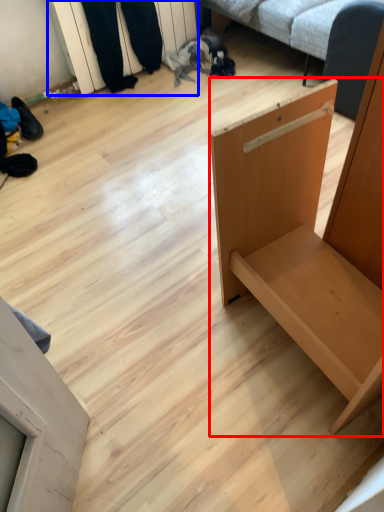
Question: Which of the following is the farthest to the observer, furniture (highlighted by a red box) or shelf (highlighted by a blue box)?

Choices:
 (A) furniture
 (B) shelf

Answer: (B)